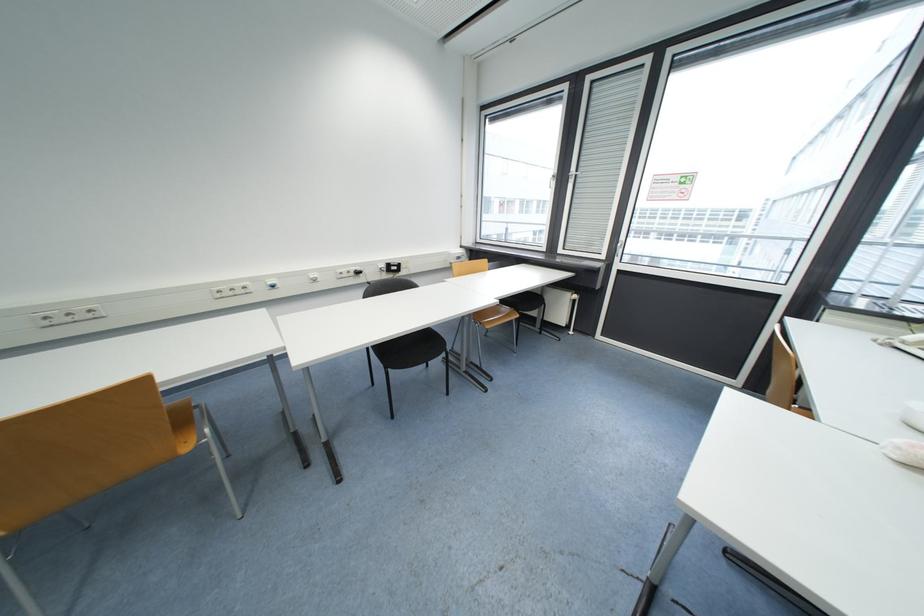
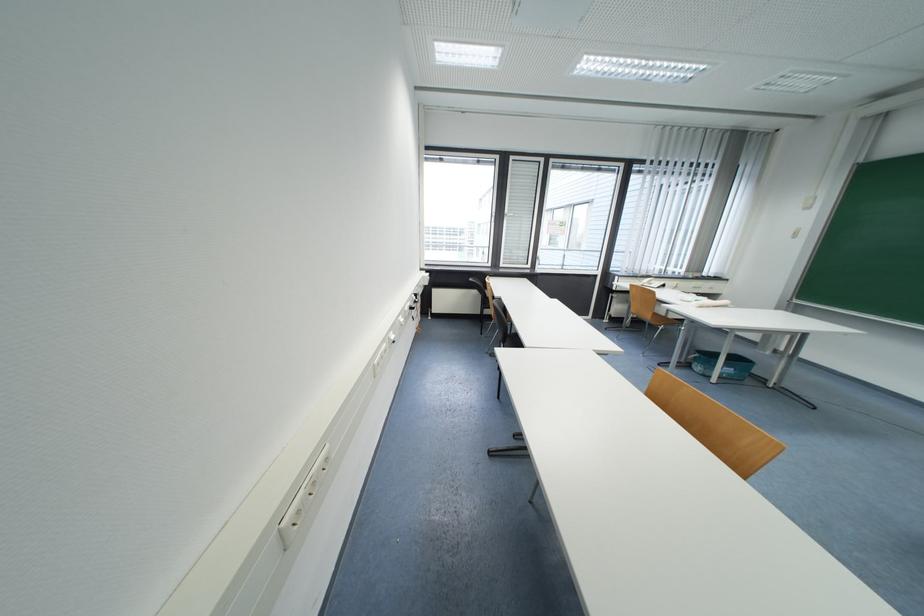
The point at (344, 273) is marked in the first image. Where is the corresponding point in the second image?

(411, 310)